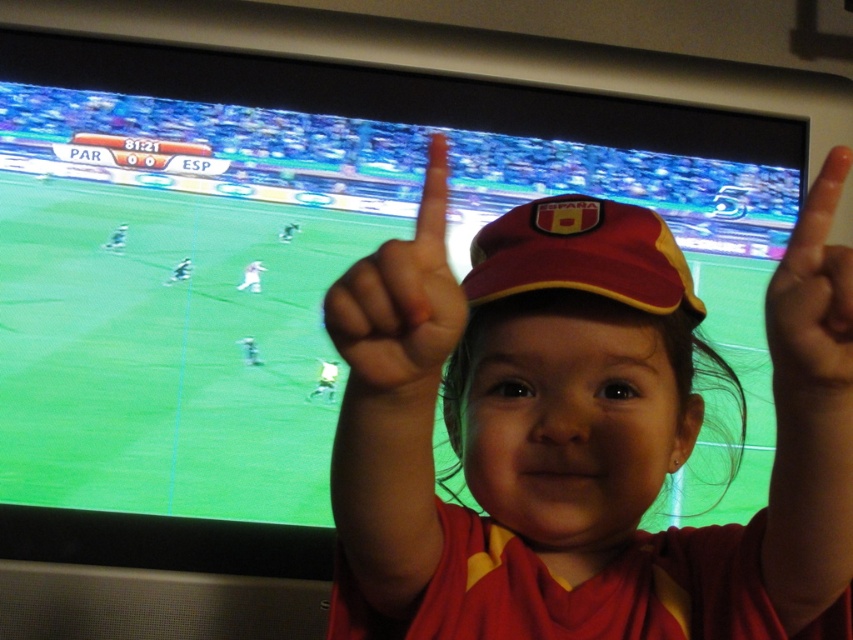
You are a photographer capturing the scene of a child pointing at a soccer match. You need to ensure both the matte red cap at center and the orange matte finger at upper right are visible in your photo. Based on their sizes, which object should you focus on to ensure both are in frame?

The matte red cap at center is taller than the orange matte finger at upper right, so focusing on the matte red cap at center will help ensure both objects are visible in the photo.

You are a photographer capturing the scene. You notice the matte red baseball cap at center and the orange matte finger at upper right. Which object is positioned higher in the image?

The matte red baseball cap at center is located above the orange matte finger at upper right, so it is positioned higher in the image.

You are a photographer capturing this scene. You notice the matte red cap at center and the orange matte finger at upper right. Which object is positioned lower in the image?

The matte red cap at center is located below the orange matte finger at upper right, so the matte red cap at center is positioned lower in the image.